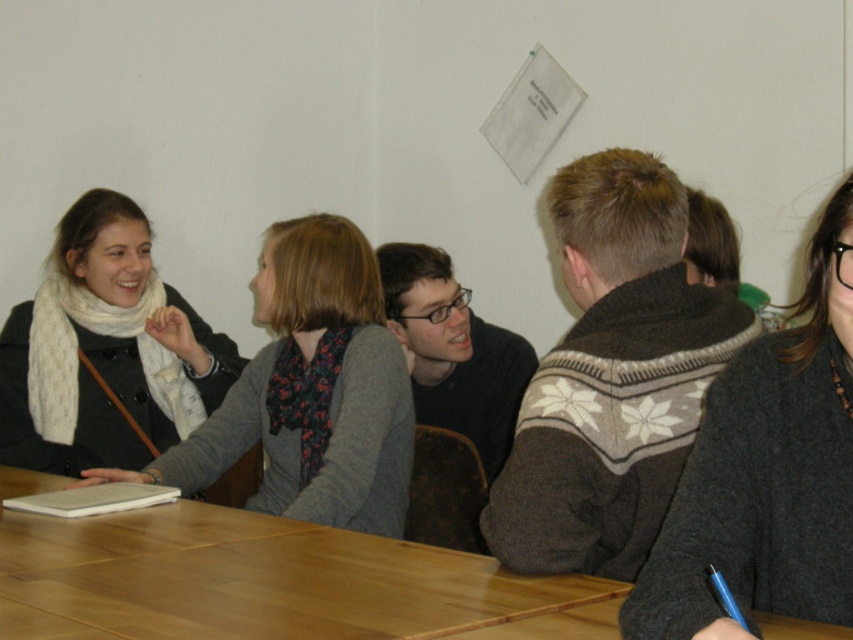
Is point (808, 444) in front of point (138, 246)?

Yes.

Find the location of `dark gray sweater at right`. dark gray sweater at right is located at coordinates (767, 472).

Is wooden table at center positioned in front of white scarf at upper left?

Yes, wooden table at center is closer to the viewer.

Does wooden table at center appear on the left side of white scarf at upper left?

Correct, you'll find wooden table at center to the left of white scarf at upper left.

Does point (453, 609) come farther from viewer compared to point (283, 387)?

No, it is not.

Locate an element on the screen. Image resolution: width=853 pixels, height=640 pixels. wooden table at center is located at coordinates [270, 582].

Between white scarf at upper left and white scarf at left, which one appears on the right side from the viewer's perspective?

white scarf at upper left is more to the right.

Between white scarf at upper left and white scarf at left, which one appears on the left side from the viewer's perspective?

From the viewer's perspective, white scarf at left appears more on the left side.

Is point (267, 465) positioned behind point (19, 330)?

Yes, it is behind point (19, 330).

This screenshot has width=853, height=640. In order to click on white scarf at upper left in this screenshot , I will do `click(311, 392)`.